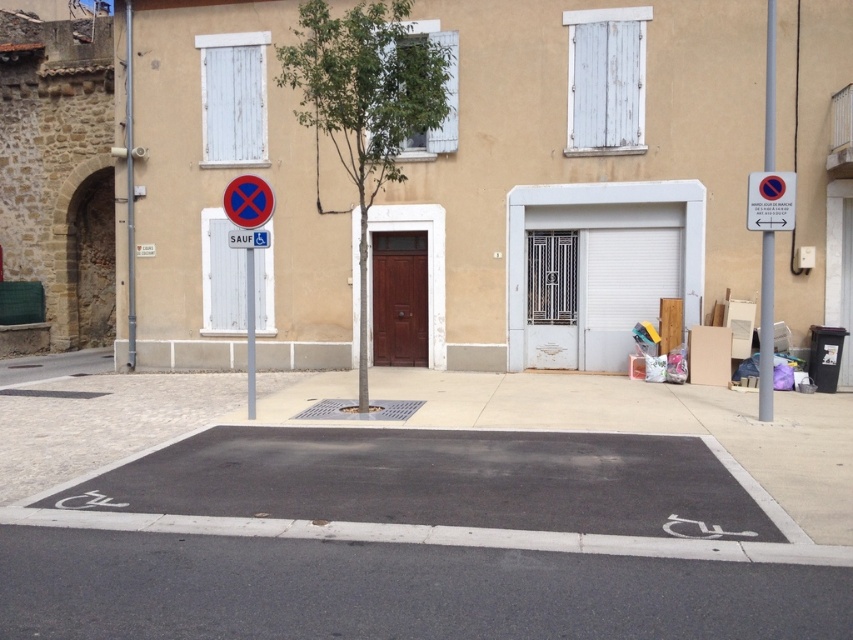
Does blue plastic circle at upper center appear over red plastic sign at center?

Yes, blue plastic circle at upper center is above red plastic sign at center.

Between blue plastic circle at upper center and red plastic sign at center, which one is positioned higher?

Positioned higher is blue plastic circle at upper center.

This screenshot has height=640, width=853. What are the coordinates of `blue plastic circle at upper center` in the screenshot? It's located at (248, 200).

Is point (767, 124) closer to camera compared to point (241, 237)?

No, it is not.

Is metallic signpost at right to the right of red plastic sign at center from the viewer's perspective?

Yes, metallic signpost at right is to the right of red plastic sign at center.

Which is behind, point (770, 134) or point (247, 244)?

Positioned behind is point (770, 134).

This screenshot has height=640, width=853. I want to click on metallic signpost at right, so click(x=766, y=328).

Between blue plastic circle at upper center and metallic pole at center, which one is positioned lower?

Positioned lower is metallic pole at center.

Can you confirm if blue plastic circle at upper center is positioned below metallic pole at center?

Actually, blue plastic circle at upper center is above metallic pole at center.

This screenshot has width=853, height=640. I want to click on blue plastic circle at upper center, so click(x=248, y=200).